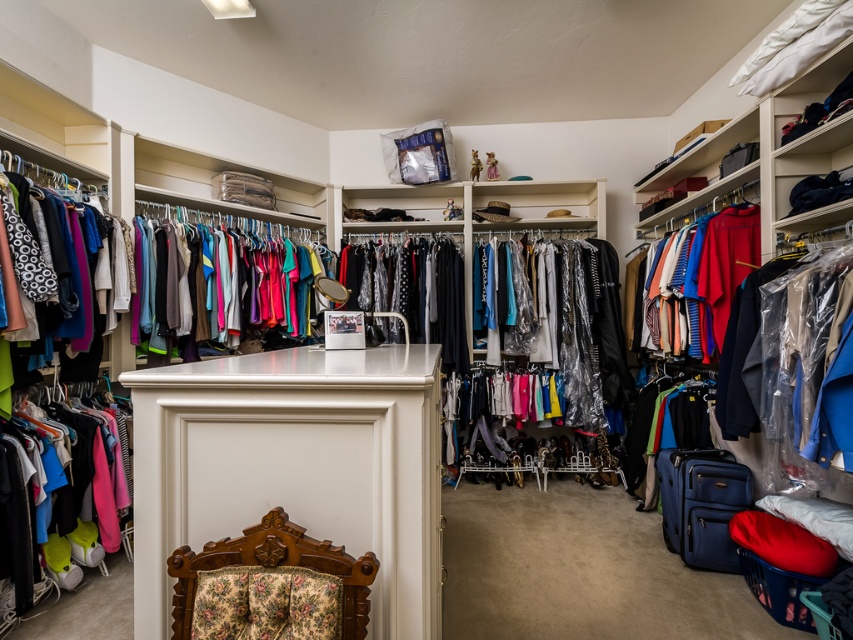
Question: Which object is positioned farthest from the matte fabric shirts at center?

Choices:
 (A) matte plastic coat at right
 (B) matte fabric shirts at right
 (C) matte black dress at center
 (D) clear plastic coat at center

Answer: (A)

Question: Does matte fabric shirts at center have a smaller size compared to matte black dress at center?

Choices:
 (A) no
 (B) yes

Answer: (A)

Question: Can you confirm if clear plastic coat at center is thinner than matte fabric shirts at right?

Choices:
 (A) no
 (B) yes

Answer: (A)

Question: Which object is closer to the camera taking this photo?

Choices:
 (A) matte plastic coat at right
 (B) matte fabric shirts at right
 (C) clear plastic coat at center

Answer: (A)

Question: Does floral fabric chair at lower center have a lesser width compared to matte black dress at center?

Choices:
 (A) no
 (B) yes

Answer: (B)

Question: Which point appears farthest from the camera in this image?

Choices:
 (A) (790, 301)
 (B) (346, 572)
 (C) (416, 276)
 (D) (68, 419)

Answer: (C)